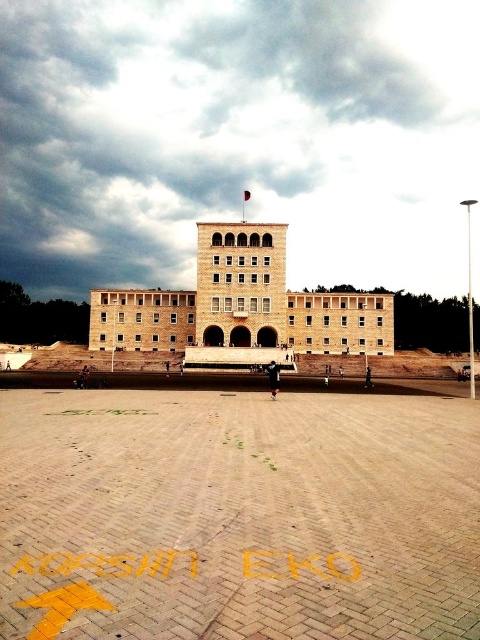
Question: Which object appears farthest from the camera in this image?

Choices:
 (A) brown brick tower at center
 (B) beige stone building at center

Answer: (A)

Question: Among these objects, which one is farthest from the camera?

Choices:
 (A) beige stone building at center
 (B) brown brick tower at center

Answer: (B)

Question: Can you confirm if beige stone building at center is smaller than brown brick tower at center?

Choices:
 (A) yes
 (B) no

Answer: (B)

Question: Does beige stone building at center appear over brown brick tower at center?

Choices:
 (A) no
 (B) yes

Answer: (A)

Question: Which of the following is the farthest from the observer?

Choices:
 (A) (165, 296)
 (B) (222, 328)

Answer: (A)

Question: Does beige stone building at center have a lesser width compared to brown brick tower at center?

Choices:
 (A) no
 (B) yes

Answer: (A)